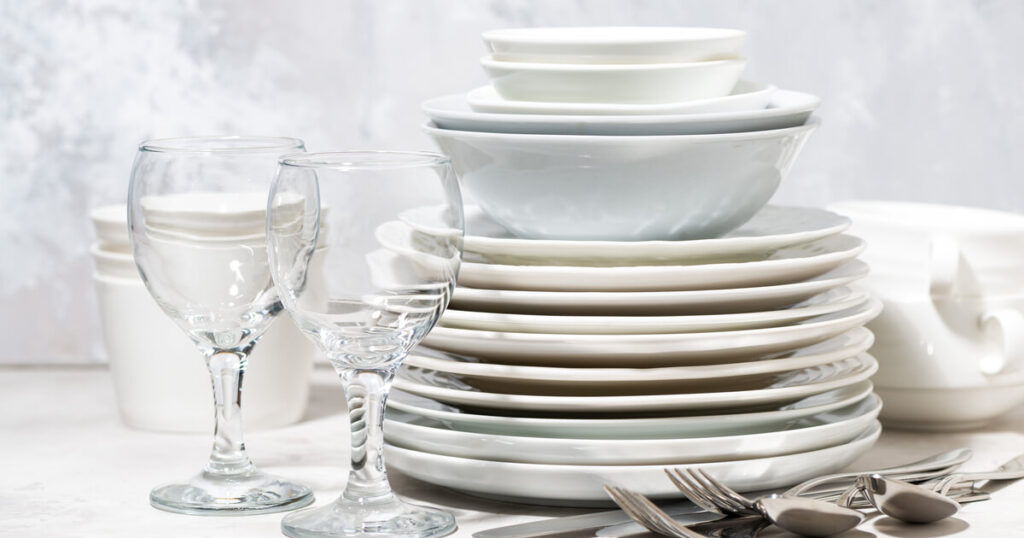
In order to click on utensils in this screenshot , I will do `click(688, 532)`, `click(610, 518)`, `click(726, 505)`, `click(801, 523)`, `click(903, 506)`.